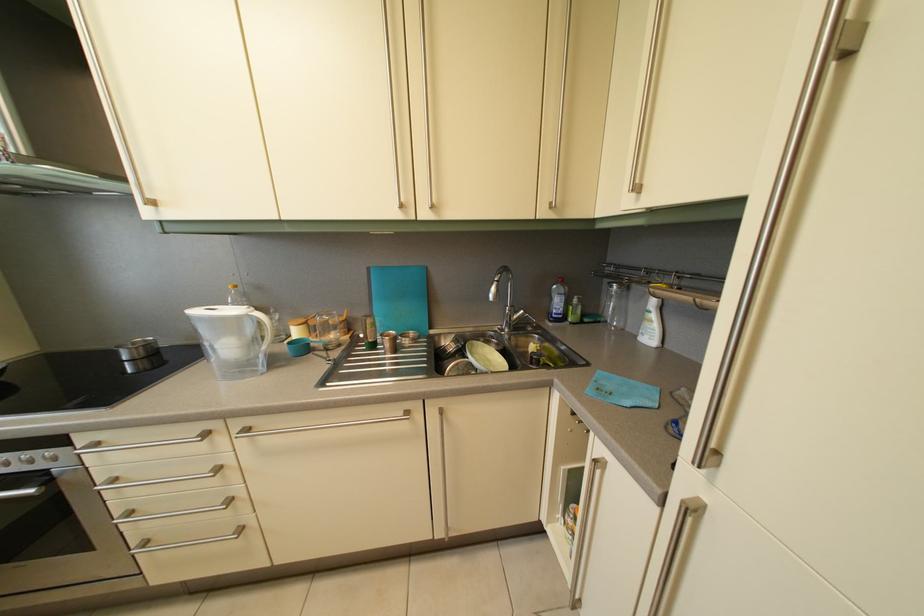
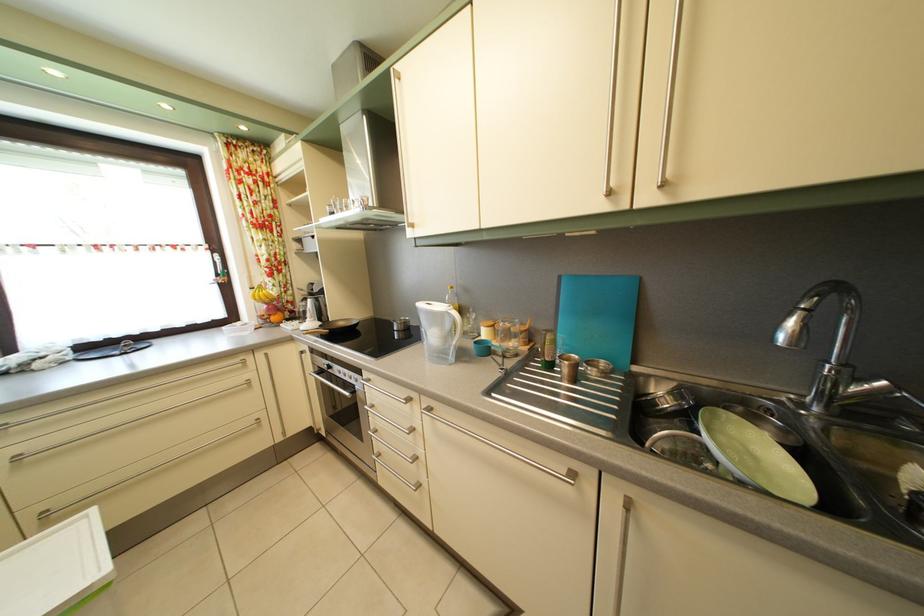
Find the pixel in the second image that matches the point at 298,351 in the first image.

(483, 350)